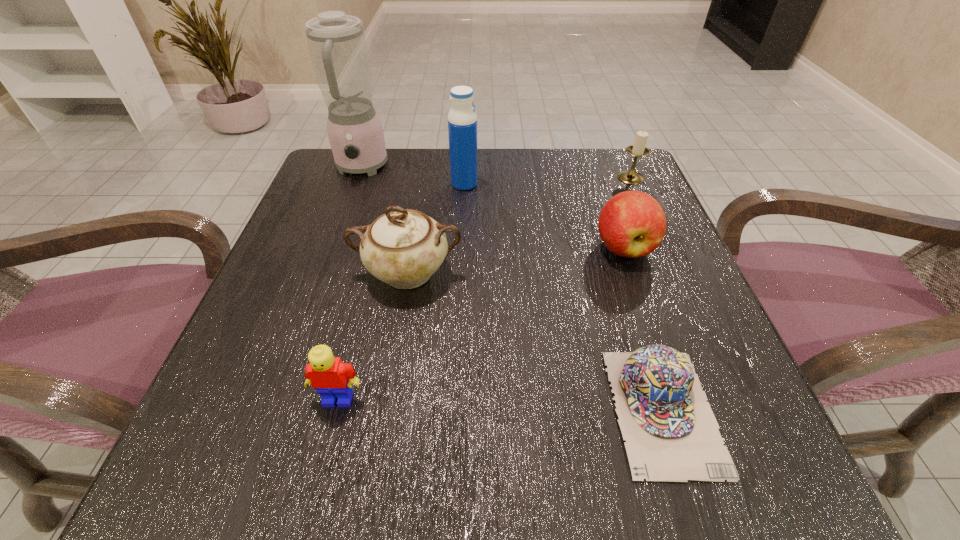
The image size is (960, 540). What are the coordinates of `the second closest object relative to the apple` in the screenshot? It's located at (671, 433).

Locate which object ranks fifth in proximity to the apple. Please provide its 2D coordinates. Your answer should be formatted as a tuple, i.e. [(x, y)], where the tuple contains the x and y coordinates of a point satisfying the conditions above.

[(332, 379)]

Find the location of a particular element. This screenshot has height=540, width=960. free space that satisfies the following two spatial constraints: 1. on the base of the apple near the control knob; 2. on the left side of the tallest object is located at coordinates (333, 247).

This screenshot has height=540, width=960. In order to click on vacant space that satisfies the following two spatial constraints: 1. on the base of the tallest object near the control knob; 2. on the right side of the candle holder in this screenshot , I will do `click(358, 178)`.